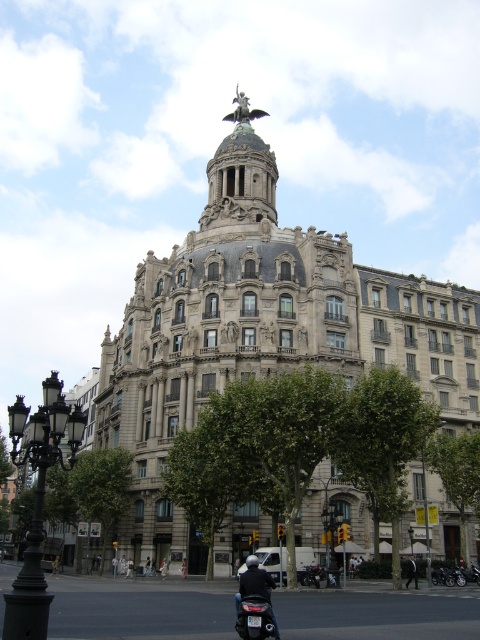
Who is positioned more to the left, green leafy tree at lower left or matte black scooter at lower center?

green leafy tree at lower left

Who is taller, green leafy tree at lower left or matte black scooter at lower center?

green leafy tree at lower left is taller.

This screenshot has width=480, height=640. What do you see at coordinates (101, 486) in the screenshot?
I see `green leafy tree at lower left` at bounding box center [101, 486].

Identify the location of green leafy tree at lower left. (101, 486).

Between point (25, 419) and point (453, 477), which one is positioned behind?

The point (453, 477) is behind.

Between black wrought iron streetlight at lower left and green leafy tree at lower right, which one appears on the left side from the viewer's perspective?

From the viewer's perspective, black wrought iron streetlight at lower left appears more on the left side.

Does point (44, 579) come behind point (467, 476)?

That is False.

Locate an element on the screen. This screenshot has height=640, width=480. black wrought iron streetlight at lower left is located at coordinates (37, 500).

From the picture: Does black wrought iron streetlight at lower left have a lesser width compared to matte black scooter at lower center?

In fact, black wrought iron streetlight at lower left might be wider than matte black scooter at lower center.

Is point (12, 412) farther from camera compared to point (250, 556)?

No, (12, 412) is closer to viewer.

Image resolution: width=480 pixels, height=640 pixels. Find the location of `black wrought iron streetlight at lower left`. black wrought iron streetlight at lower left is located at coordinates (37, 500).